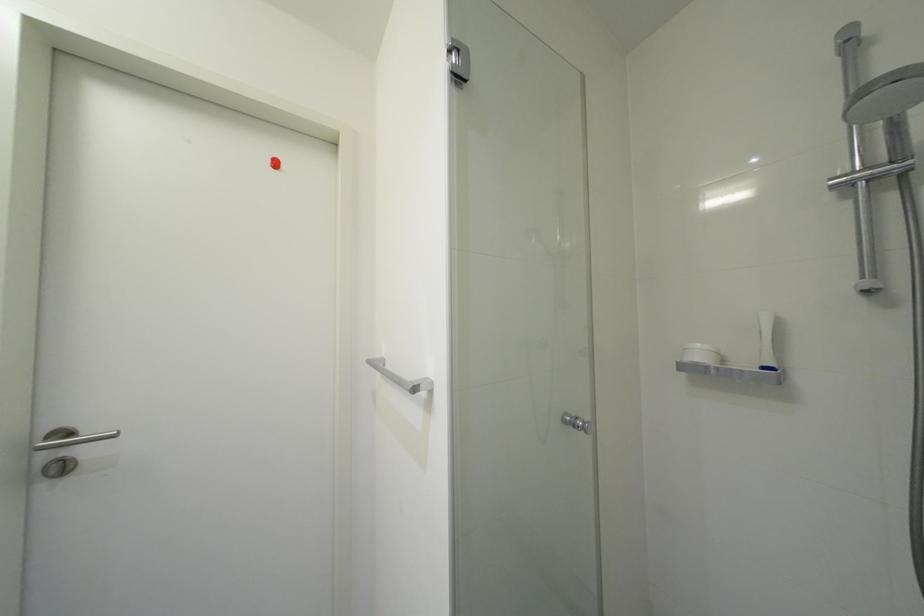
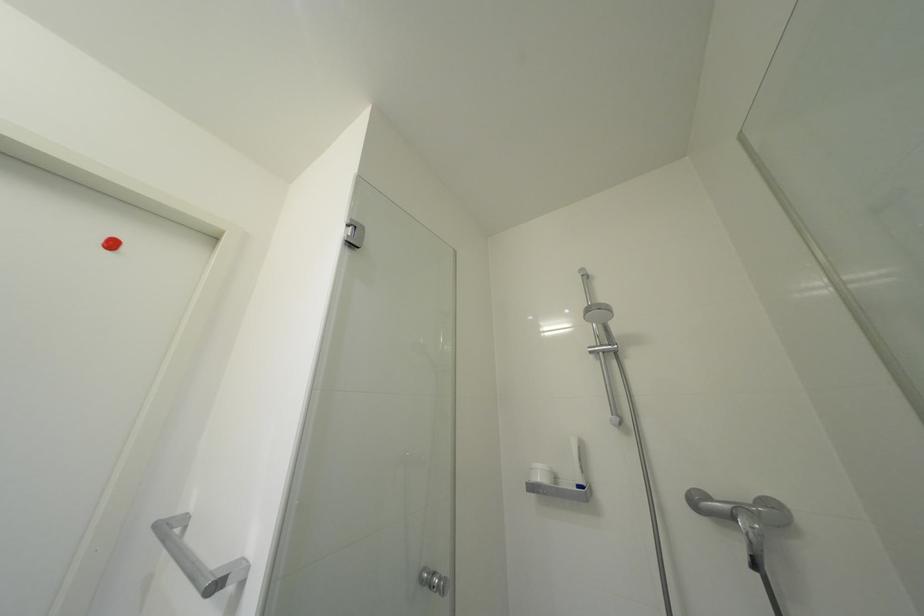
The first image is from the beginning of the video and the second image is from the end. How did the camera likely rotate when shooting the video?

The rotation direction of the camera is right-up.